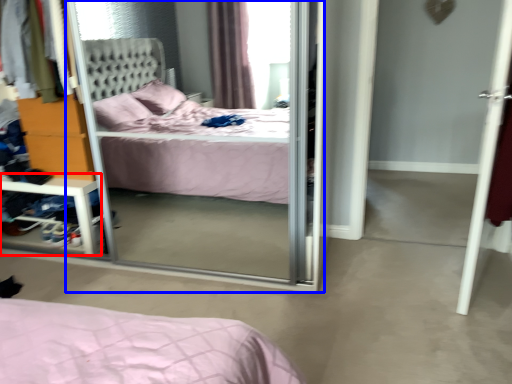
Question: Which point is closer to the camera, vanity (highlighted by a red box) or screen door (highlighted by a blue box)?

Choices:
 (A) vanity
 (B) screen door

Answer: (B)